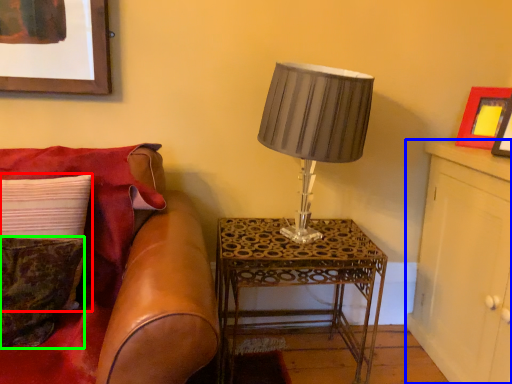
Question: Based on their relative distances, which object is nearer to pillow (highlighted by a red box)? Choose from dresser (highlighted by a blue box) and pillow (highlighted by a green box).

Choices:
 (A) dresser
 (B) pillow

Answer: (B)